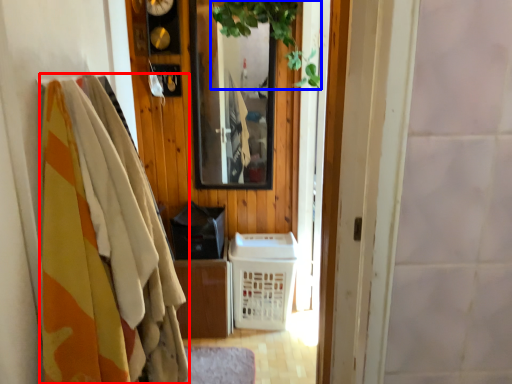
Question: Which of the following is the farthest to the observer, clothing (highlighted by a red box) or plant (highlighted by a blue box)?

Choices:
 (A) clothing
 (B) plant

Answer: (B)